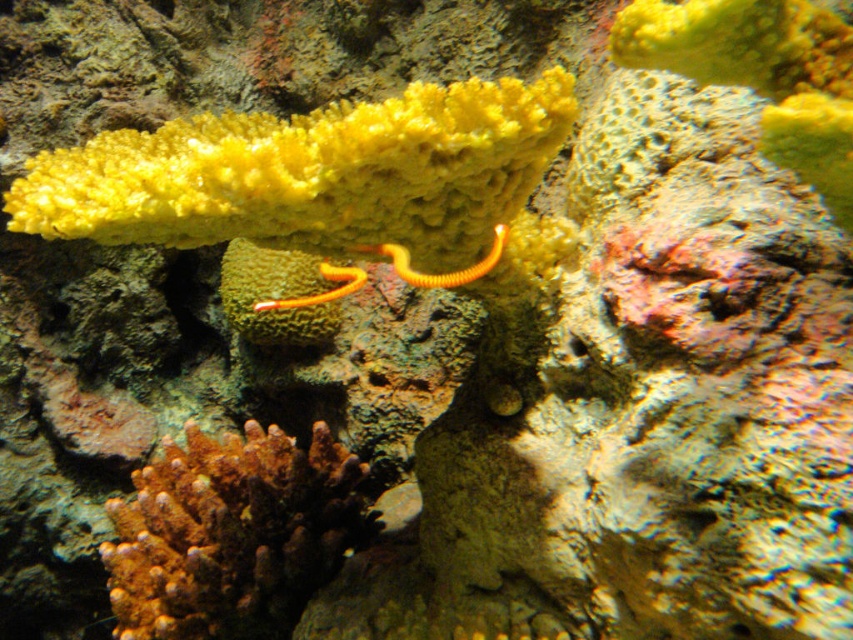
Is point (236, 572) positioned after point (398, 272)?

Yes.

Based on the photo, is orange coral at center thinner than yellow rubber worm at center?

In fact, orange coral at center might be wider than yellow rubber worm at center.

Find the location of a particular element. The width and height of the screenshot is (853, 640). orange coral at center is located at coordinates (231, 532).